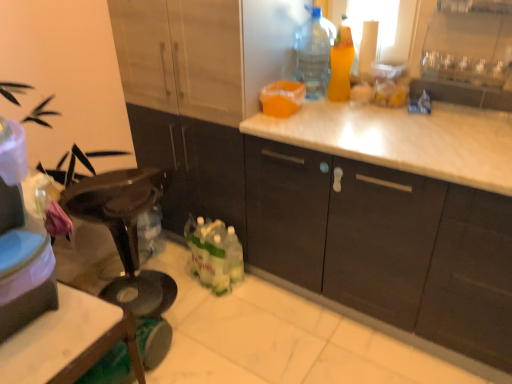
Question: Is the position of transparent plastic bottle at upper right, the 2th bottle positioned from the right, less distant than that of matte plastic container at left?

Choices:
 (A) yes
 (B) no

Answer: (B)

Question: Can you confirm if transparent plastic bottle at upper right, the 2th bottle positioned from the right, is positioned to the left of matte plastic container at left?

Choices:
 (A) yes
 (B) no

Answer: (B)

Question: Is transparent plastic bottle at upper right, the 1th bottle from the left, facing away from matte plastic container at left?

Choices:
 (A) yes
 (B) no

Answer: (B)

Question: Are transparent plastic bottle at upper right, the 1th bottle from the left, and matte plastic container at left far apart?

Choices:
 (A) yes
 (B) no

Answer: (A)

Question: Can you confirm if transparent plastic bottle at upper right, the 2th bottle positioned from the right, is shorter than matte plastic container at left?

Choices:
 (A) yes
 (B) no

Answer: (B)

Question: Does point (4, 319) appear closer or farther from the camera than point (501, 281)?

Choices:
 (A) closer
 (B) farther

Answer: (A)

Question: From the image's perspective, is matte plastic container at left located above or below matte wood cabinets at center?

Choices:
 (A) below
 (B) above

Answer: (B)

Question: In terms of width, does matte plastic container at left look wider or thinner when compared to matte wood cabinets at center?

Choices:
 (A) wide
 (B) thin

Answer: (B)

Question: From a real-world perspective, is matte plastic container at left positioned above or below matte wood cabinets at center?

Choices:
 (A) below
 (B) above

Answer: (B)

Question: From a real-world perspective, is translucent orange spray bottle at upper right, marked as the 1th bottle in a right-to-left arrangement, physically located above or below matte plastic container at left?

Choices:
 (A) above
 (B) below

Answer: (A)

Question: Is translucent orange spray bottle at upper right, marked as the second bottle in a left-to-right arrangement, taller or shorter than matte plastic container at left?

Choices:
 (A) short
 (B) tall

Answer: (B)

Question: Does point (330, 99) appear closer or farther from the camera than point (23, 306)?

Choices:
 (A) farther
 (B) closer

Answer: (A)

Question: Based on their positions, is translucent orange spray bottle at upper right, marked as the 1th bottle in a right-to-left arrangement, located to the left or right of matte plastic container at left?

Choices:
 (A) right
 (B) left

Answer: (A)

Question: In terms of height, does matte wood cabinets at center look taller or shorter compared to translucent orange spray bottle at upper right, marked as the 1th bottle in a right-to-left arrangement?

Choices:
 (A) tall
 (B) short

Answer: (A)

Question: Looking at their shapes, would you say matte wood cabinets at center is wider or thinner than translucent orange spray bottle at upper right, marked as the 1th bottle in a right-to-left arrangement?

Choices:
 (A) thin
 (B) wide

Answer: (B)